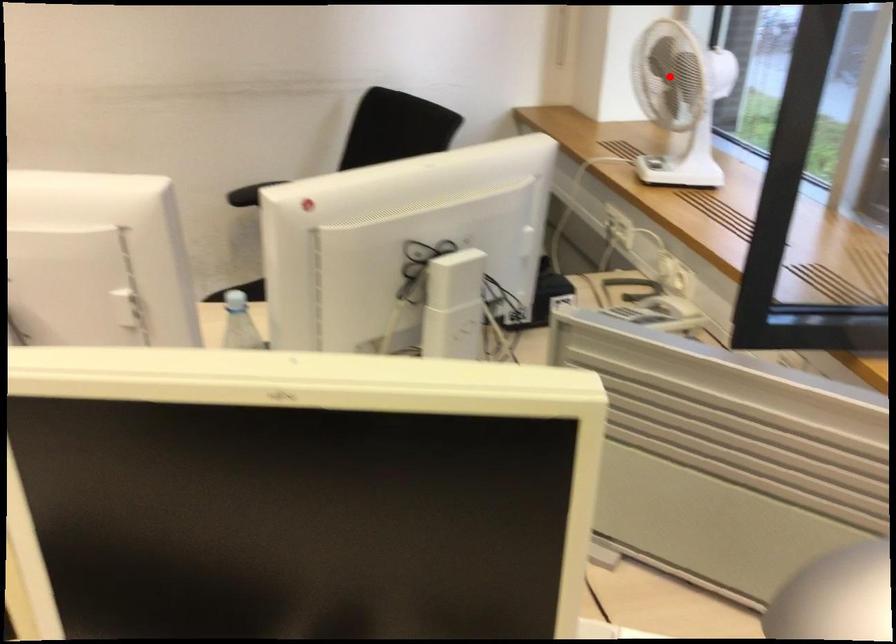
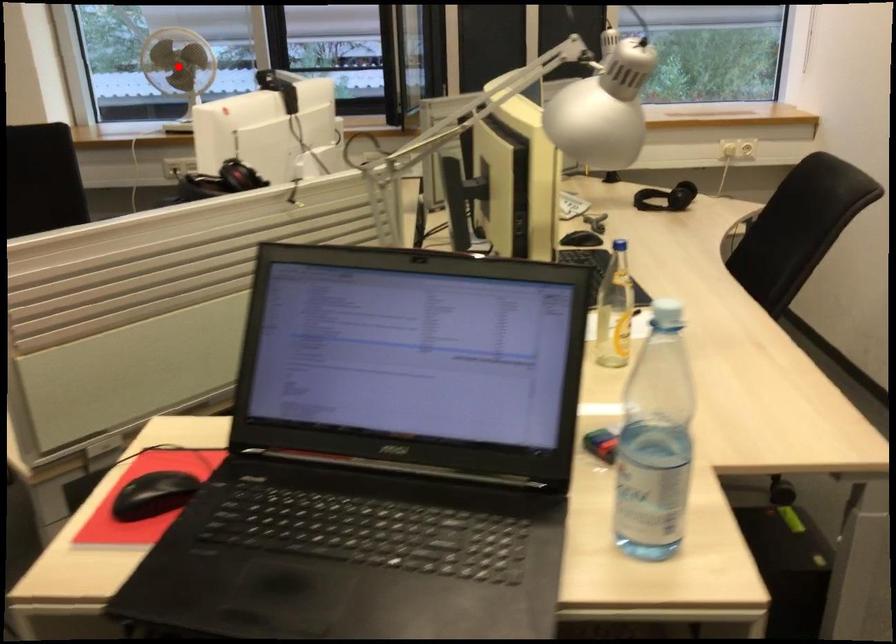
I am providing you with two images of the same scene from different viewpoints. A red point is marked on the first image and another point is marked on the second image. Do the highlighted points in image1 and image2 indicate the same real-world spot?

Yes